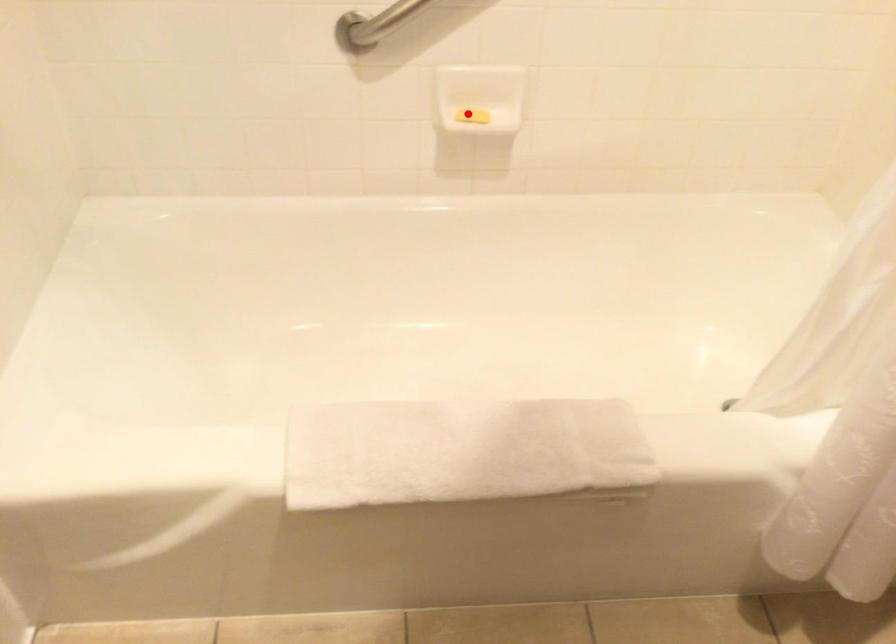
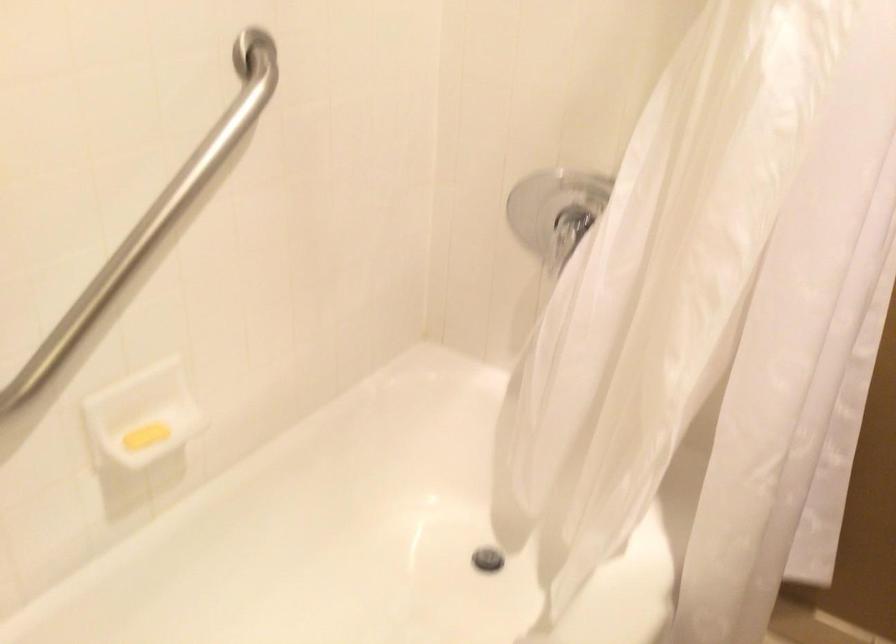
Find the pixel in the second image that matches the highlighted location in the first image.

(145, 436)